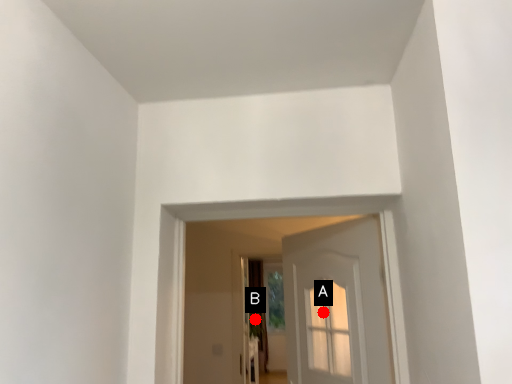
Question: Two points are circled on the image, labeled by A and B beside each circle. Which point appears closest to the camera in this image?

Choices:
 (A) A is closer
 (B) B is closer

Answer: (A)